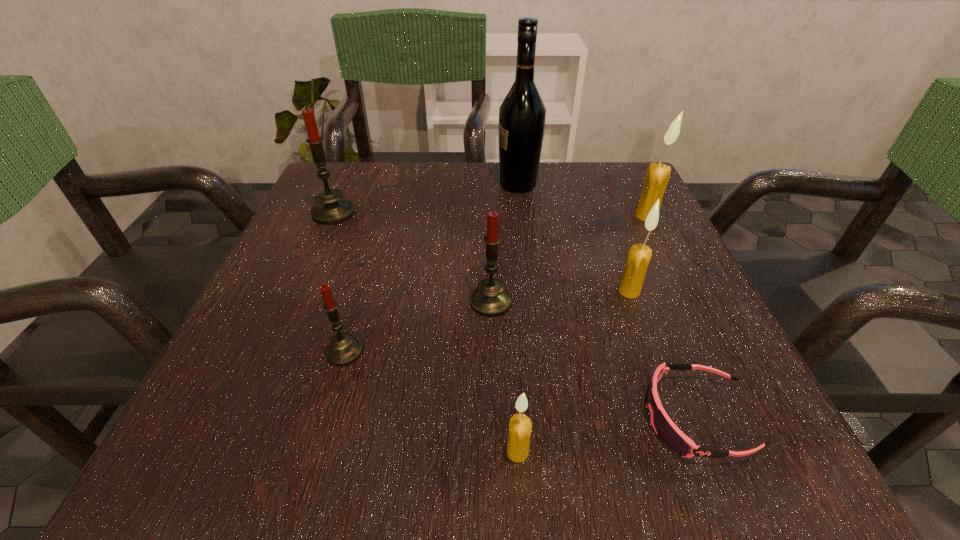
The width and height of the screenshot is (960, 540). What are the coordinates of `vacant area situated 0.170m on the front of the rightmost candle` in the screenshot? It's located at (677, 278).

At what (x,y) coordinates should I click in order to perform the action: click on free space located 0.330m on the left of the rightmost red candle. Please return your answer as a coordinate pair (x, y). Looking at the image, I should click on (271, 302).

I want to click on vacant region located 0.100m on the left of the second farthest cream candle, so click(560, 291).

Find the location of a particular element. The height and width of the screenshot is (540, 960). free space located on the front of the second red candle from left to right is located at coordinates (324, 424).

Identify the location of free space located 0.170m on the left of the leftmost cream candle. The image size is (960, 540). (368, 452).

The width and height of the screenshot is (960, 540). In order to click on vacant point located on the front-facing side of the goggles in this screenshot , I will do `click(352, 417)`.

Image resolution: width=960 pixels, height=540 pixels. In order to click on vacant space located 0.190m on the front-facing side of the goggles in this screenshot , I will do `click(499, 417)`.

At what (x,y) coordinates should I click in order to perform the action: click on vacant space located on the front-facing side of the goggles. Please return your answer as a coordinate pair (x, y). Image resolution: width=960 pixels, height=540 pixels. Looking at the image, I should click on (522, 417).

The image size is (960, 540). I want to click on wine bottle that is at the far edge, so click(522, 114).

Identify the location of candle located at the near edge. This screenshot has height=540, width=960. (520, 427).